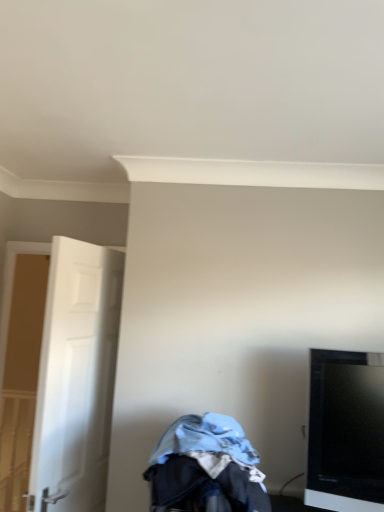
Question: Can you confirm if black glossy tv at right is thinner than denim fabric baby carriage at lower center?

Choices:
 (A) yes
 (B) no

Answer: (A)

Question: Is black glossy tv at right taller than denim fabric baby carriage at lower center?

Choices:
 (A) yes
 (B) no

Answer: (A)

Question: Is black glossy tv at right to the left of denim fabric baby carriage at lower center from the viewer's perspective?

Choices:
 (A) yes
 (B) no

Answer: (B)

Question: From the image's perspective, does black glossy tv at right appear higher than denim fabric baby carriage at lower center?

Choices:
 (A) yes
 (B) no

Answer: (A)

Question: Is black glossy tv at right shorter than denim fabric baby carriage at lower center?

Choices:
 (A) no
 (B) yes

Answer: (A)

Question: From the image's perspective, is black glossy tv at right located beneath denim fabric baby carriage at lower center?

Choices:
 (A) no
 (B) yes

Answer: (A)

Question: Are denim fabric baby carriage at lower center and black glossy tv at right far apart?

Choices:
 (A) no
 (B) yes

Answer: (A)

Question: Considering the relative sizes of denim fabric baby carriage at lower center and black glossy tv at right in the image provided, is denim fabric baby carriage at lower center smaller than black glossy tv at right?

Choices:
 (A) yes
 (B) no

Answer: (B)

Question: Can black glossy tv at right be found inside denim fabric baby carriage at lower center?

Choices:
 (A) yes
 (B) no

Answer: (B)

Question: From a real-world perspective, does denim fabric baby carriage at lower center stand above black glossy tv at right?

Choices:
 (A) yes
 (B) no

Answer: (B)

Question: From the image's perspective, is denim fabric baby carriage at lower center located above black glossy tv at right?

Choices:
 (A) no
 (B) yes

Answer: (A)

Question: Is denim fabric baby carriage at lower center outside black glossy tv at right?

Choices:
 (A) yes
 (B) no

Answer: (A)

Question: Does white matte door at left come behind black glossy tv at right?

Choices:
 (A) no
 (B) yes

Answer: (B)